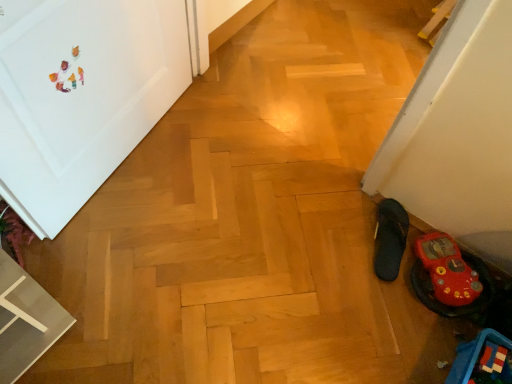
What do you see at coordinates (450, 277) in the screenshot?
I see `rubber flip-flop at lower right, which is the 2th footwear in left-to-right order` at bounding box center [450, 277].

This screenshot has width=512, height=384. What are the coordinates of `blue plastic toy at lower right` in the screenshot? It's located at (473, 355).

Describe the element at coordinates (473, 355) in the screenshot. The image size is (512, 384). I see `blue plastic toy at lower right` at that location.

The image size is (512, 384). Identify the location of white matte door at upper left. (81, 96).

Locate an element on the screen. This screenshot has width=512, height=384. rubber flip-flop at lower right, acting as the 1th footwear starting from the right is located at coordinates (450, 277).

From a real-world perspective, who is located lower, white matte door at upper left or blue plastic toy at lower right?

From a 3D spatial view, blue plastic toy at lower right is below.

What's the angular difference between white matte door at upper left and blue plastic toy at lower right's facing directions?

The angle between the facing direction of white matte door at upper left and the facing direction of blue plastic toy at lower right is 97.4 degrees.

Is white matte door at upper left aimed at blue plastic toy at lower right?

Yes, white matte door at upper left is oriented towards blue plastic toy at lower right.

Are white matte door at upper left and blue plastic toy at lower right far apart?

Yes, white matte door at upper left is far from blue plastic toy at lower right.

Who is smaller, black fabric slipper at lower right, the 2th footwear viewed from the right, or rubber flip-flop at lower right, acting as the 1th footwear starting from the right?

black fabric slipper at lower right, the 2th footwear viewed from the right.

From a real-world perspective, is black fabric slipper at lower right, positioned as the 1th footwear in left-to-right order, physically below rubber flip-flop at lower right, which is the 2th footwear in left-to-right order?

Yes, from a real-world perspective, black fabric slipper at lower right, positioned as the 1th footwear in left-to-right order, is under rubber flip-flop at lower right, which is the 2th footwear in left-to-right order.

Is rubber flip-flop at lower right, acting as the 1th footwear starting from the right, at the back of black fabric slipper at lower right, positioned as the 1th footwear in left-to-right order?

black fabric slipper at lower right, positioned as the 1th footwear in left-to-right order, is not turned away from rubber flip-flop at lower right, acting as the 1th footwear starting from the right.

Can you confirm if rubber flip-flop at lower right, which is the 2th footwear in left-to-right order, is bigger than white matte door at upper left?

No, rubber flip-flop at lower right, which is the 2th footwear in left-to-right order, is not bigger than white matte door at upper left.

Is point (467, 265) positioned after point (36, 173)?

Yes, it is.

Can you confirm if rubber flip-flop at lower right, which is the 2th footwear in left-to-right order, is shorter than white matte door at upper left?

Yes, rubber flip-flop at lower right, which is the 2th footwear in left-to-right order, is shorter than white matte door at upper left.

From the picture: Which object is further away from the camera, rubber flip-flop at lower right, which is the 2th footwear in left-to-right order, or white matte door at upper left?

rubber flip-flop at lower right, which is the 2th footwear in left-to-right order.

Considering the relative positions of black fabric slipper at lower right, positioned as the 1th footwear in left-to-right order, and blue plastic toy at lower right in the image provided, is black fabric slipper at lower right, positioned as the 1th footwear in left-to-right order, to the left of blue plastic toy at lower right from the viewer's perspective?

Yes, black fabric slipper at lower right, positioned as the 1th footwear in left-to-right order, is to the left of blue plastic toy at lower right.

Looking at the image, does black fabric slipper at lower right, positioned as the 1th footwear in left-to-right order, seem bigger or smaller compared to blue plastic toy at lower right?

In the image, black fabric slipper at lower right, positioned as the 1th footwear in left-to-right order, appears to be smaller than blue plastic toy at lower right.

From a real-world perspective, relative to blue plastic toy at lower right, is black fabric slipper at lower right, positioned as the 1th footwear in left-to-right order, vertically above or below?

black fabric slipper at lower right, positioned as the 1th footwear in left-to-right order, is situated lower than blue plastic toy at lower right in the real world.

Is black fabric slipper at lower right, positioned as the 1th footwear in left-to-right order, positioned with its back to blue plastic toy at lower right?

That's not correct — black fabric slipper at lower right, positioned as the 1th footwear in left-to-right order, is not looking away from blue plastic toy at lower right.

Is blue plastic toy at lower right positioned far away from white matte door at upper left?

Yes, blue plastic toy at lower right and white matte door at upper left are located far from each other.

Which is farther, (469, 350) or (15, 65)?

The point (469, 350) is farther from the camera.

From the image's perspective, does blue plastic toy at lower right appear lower than white matte door at upper left?

Yes, from the image's perspective, blue plastic toy at lower right is below white matte door at upper left.

Is blue plastic toy at lower right thinner than white matte door at upper left?

No, blue plastic toy at lower right is not thinner than white matte door at upper left.

Does black fabric slipper at lower right, the 2th footwear viewed from the right, have a lesser height compared to white matte door at upper left?

Correct, black fabric slipper at lower right, the 2th footwear viewed from the right, is not as tall as white matte door at upper left.

From a real-world perspective, is black fabric slipper at lower right, positioned as the 1th footwear in left-to-right order, located higher than white matte door at upper left?

No, from a real-world perspective, black fabric slipper at lower right, positioned as the 1th footwear in left-to-right order, is not above white matte door at upper left.

In the scene shown: From a real-world perspective, between white matte door at upper left and black fabric slipper at lower right, positioned as the 1th footwear in left-to-right order, who is vertically lower?

black fabric slipper at lower right, positioned as the 1th footwear in left-to-right order.

At what (x,y) coordinates should I click in order to perform the action: click on door above the black fabric slipper at lower right, positioned as the 1th footwear in left-to-right order (from the image's perspective). Please return your answer as a coordinate pair (x, y). Looking at the image, I should click on (81, 96).

Is white matte door at upper left to the left of black fabric slipper at lower right, positioned as the 1th footwear in left-to-right order, from the viewer's perspective?

Correct, you'll find white matte door at upper left to the left of black fabric slipper at lower right, positioned as the 1th footwear in left-to-right order.

This screenshot has height=384, width=512. I want to click on door above the blue plastic toy at lower right (from a real-world perspective), so [x=81, y=96].

Where is `footwear above the rubber flip-flop at lower right, which is the 2th footwear in left-to-right order (from the image's perspective)`? footwear above the rubber flip-flop at lower right, which is the 2th footwear in left-to-right order (from the image's perspective) is located at coordinates (389, 238).

In the scene shown: Based on their spatial positions, is rubber flip-flop at lower right, which is the 2th footwear in left-to-right order, or white matte door at upper left further from blue plastic toy at lower right?

white matte door at upper left is further to blue plastic toy at lower right.

Estimate the real-world distances between objects in this image. Which object is closer to rubber flip-flop at lower right, acting as the 1th footwear starting from the right, blue plastic toy at lower right or black fabric slipper at lower right, positioned as the 1th footwear in left-to-right order?

black fabric slipper at lower right, positioned as the 1th footwear in left-to-right order.

From the picture: Based on their spatial positions, is rubber flip-flop at lower right, which is the 2th footwear in left-to-right order, or blue plastic toy at lower right closer to black fabric slipper at lower right, positioned as the 1th footwear in left-to-right order?

Based on the image, rubber flip-flop at lower right, which is the 2th footwear in left-to-right order, appears to be nearer to black fabric slipper at lower right, positioned as the 1th footwear in left-to-right order.

From the image, which object appears to be nearer to rubber flip-flop at lower right, acting as the 1th footwear starting from the right, blue plastic toy at lower right or white matte door at upper left?

Based on the image, blue plastic toy at lower right appears to be nearer to rubber flip-flop at lower right, acting as the 1th footwear starting from the right.

Based on their spatial positions, is black fabric slipper at lower right, positioned as the 1th footwear in left-to-right order, or blue plastic toy at lower right closer to white matte door at upper left?

black fabric slipper at lower right, positioned as the 1th footwear in left-to-right order.

Considering their positions, is blue plastic toy at lower right positioned further to white matte door at upper left than rubber flip-flop at lower right, acting as the 1th footwear starting from the right?

Among the two, blue plastic toy at lower right is located further to white matte door at upper left.

When comparing their distances from black fabric slipper at lower right, the 2th footwear viewed from the right, does rubber flip-flop at lower right, acting as the 1th footwear starting from the right, or white matte door at upper left seem closer?

rubber flip-flop at lower right, acting as the 1th footwear starting from the right.

When comparing their distances from rubber flip-flop at lower right, which is the 2th footwear in left-to-right order, does white matte door at upper left or blue plastic toy at lower right seem further?

white matte door at upper left.

What are the coordinates of `footwear between white matte door at upper left and rubber flip-flop at lower right, which is the 2th footwear in left-to-right order, in the horizontal direction` in the screenshot? It's located at (389, 238).

Identify the location of footwear between black fabric slipper at lower right, the 2th footwear viewed from the right, and blue plastic toy at lower right from top to bottom. This screenshot has height=384, width=512. (450, 277).